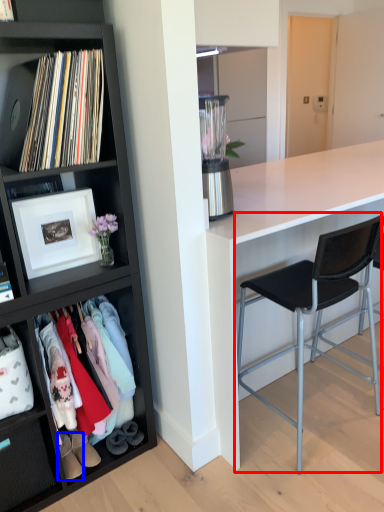
Question: Which point is further to the camera, chair (highlighted by a red box) or footwear (highlighted by a blue box)?

Choices:
 (A) chair
 (B) footwear

Answer: (B)